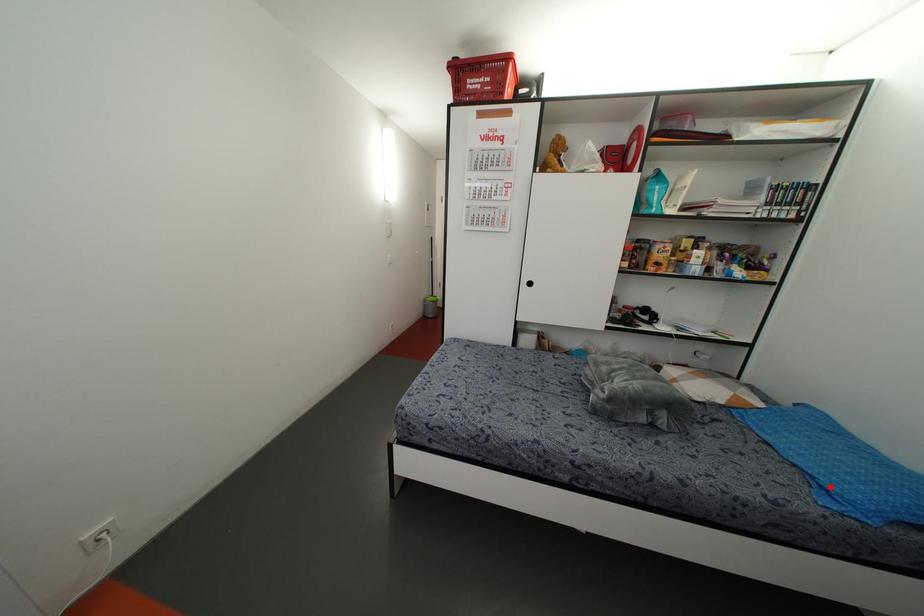
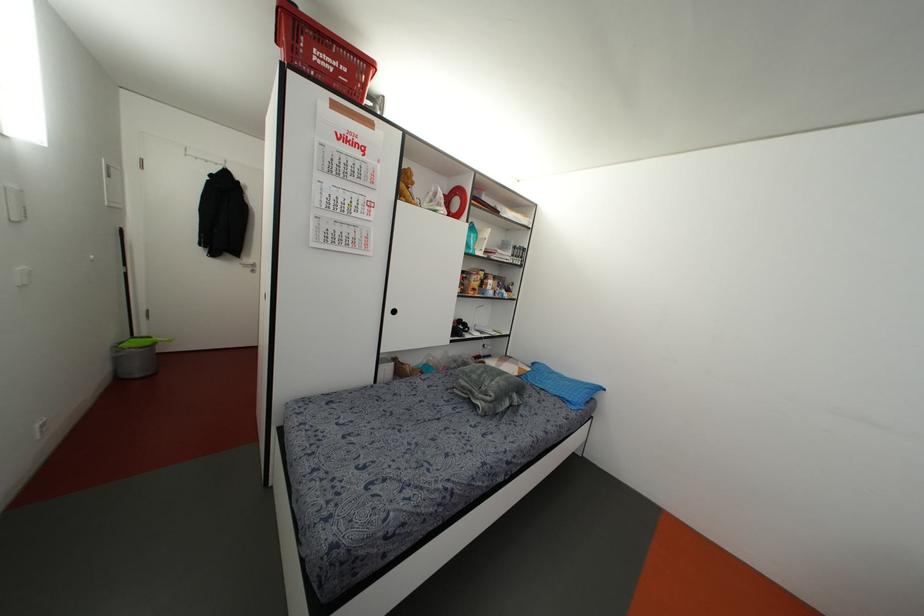
Question: I am providing you with two images of the same scene from different viewpoints. A red point is shown in image1. For the corresponding object point in image2, is it positioned nearer or farther from the camera?

Choices:
 (A) Nearer
 (B) Farther

Answer: (B)